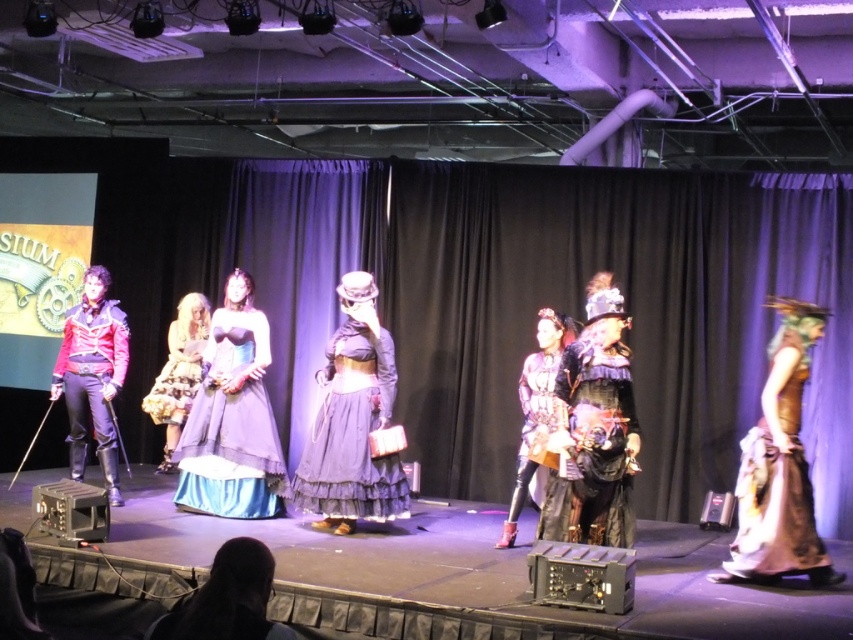
You are a photographer positioned at the back of the stage. You need to capture a photo that includes both the blue satin dress at center and the shiny leather jacket at left. Given their widths, which object should you ensure is closer to the camera to avoid cropping either?

The blue satin dress at center is wider than the shiny leather jacket at left. To avoid cropping either, position the camera so the blue satin dress at center is closer to the camera, as its greater width will require more space in the frame.

Based on the photo, you are a photographer at the event and need to ensure both the gray satin dress at center and the shiny leather jacket at left are fully visible in your wide shot. Given their sizes, which one might require more careful framing to avoid being cut off?

The gray satin dress at center is larger in size than the shiny leather jacket at left, so it might require more careful framing to avoid being cut off.

You are a photographer positioned at the camera. You need to capture a closeup shot of the gray satin dress at center. Considering the distance, is the dress within your camera lens range if your camera can focus as close as 5 meters?

The gray satin dress at center is 6.20 meters away from camera, which is beyond the camera lens range since the minimum focus distance is 5 meters. You need to move closer or use a different lens.